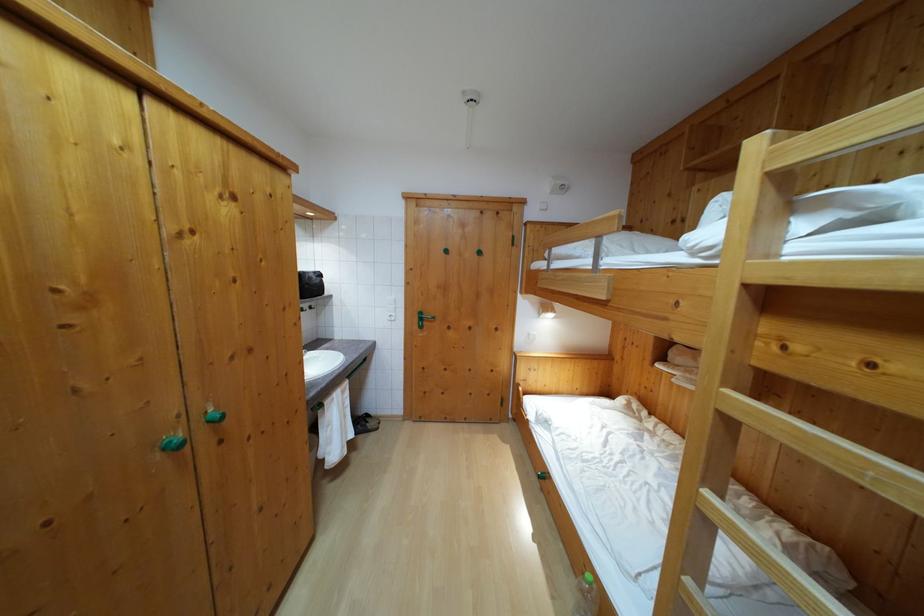
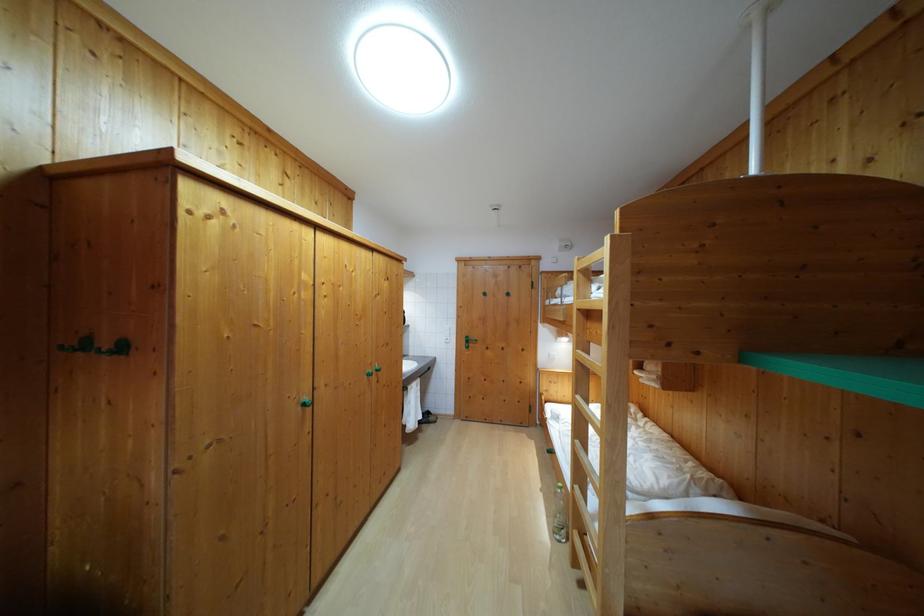
Question: The images are taken continuously from a first-person perspective. In which direction are you moving?

Choices:
 (A) Left
 (B) Right
 (C) Forward
 (D) Backward

Answer: (D)